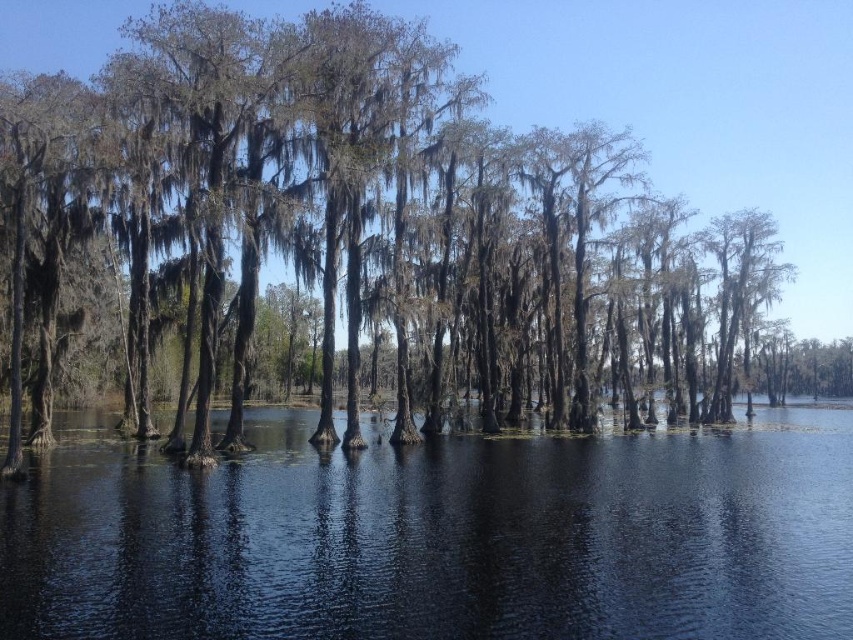
Question: Is transparent water at center positioned before smooth bark trees at center?

Choices:
 (A) no
 (B) yes

Answer: (B)

Question: Does transparent water at center lie behind smooth bark trees at center?

Choices:
 (A) no
 (B) yes

Answer: (A)

Question: Among these points, which one is nearest to the camera?

Choices:
 (A) (82, 602)
 (B) (679, 52)

Answer: (A)

Question: Is transparent water at center to the right of smooth bark trees at center from the viewer's perspective?

Choices:
 (A) no
 (B) yes

Answer: (A)

Question: Which of the following is the closest to the observer?

Choices:
 (A) transparent water at center
 (B) smooth bark trees at center

Answer: (A)